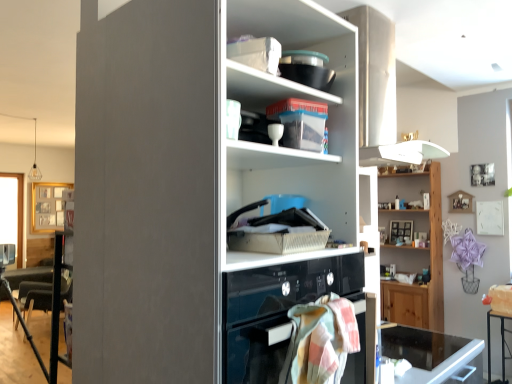
Image resolution: width=512 pixels, height=384 pixels. I want to click on pastel plaid towel at lower center, so click(x=321, y=341).

Identify the location of translucent plastic container at upper center, the first shelf viewed from the top. (270, 85).

Measure the distance between point (272,82) and camera.

A distance of 1.19 meters exists between point (272,82) and camera.

This screenshot has width=512, height=384. I want to click on white glossy cupboard at center, so click(x=202, y=192).

Is pastel plaid towel at lower center positioned with its back to white glossy cupboard at center?

pastel plaid towel at lower center does not have its back to white glossy cupboard at center.

From a real-world perspective, does pastel plaid towel at lower center stand above white glossy cupboard at center?

Actually, pastel plaid towel at lower center is physically below white glossy cupboard at center in the real world.

Can you confirm if pastel plaid towel at lower center is shorter than white glossy cupboard at center?

Indeed, pastel plaid towel at lower center has a lesser height compared to white glossy cupboard at center.

From a real-world perspective, which object rests below the other?

In real-world perspective, black glass desk at lower right is lower.

From the image's perspective, would you say white glossy cupboard at center is shown under black glass desk at lower right?

No.

How much distance is there between white glossy cupboard at center and black glass desk at lower right?

white glossy cupboard at center and black glass desk at lower right are 1.20 meters apart.

Is point (356, 51) behind point (429, 337)?

No, (356, 51) is in front of (429, 337).

Is translucent plastic container at upper center, which is counted as the 2th shelf, starting from the bottom, aimed at pastel plaid towel at lower center?

No, translucent plastic container at upper center, which is counted as the 2th shelf, starting from the bottom, is not turned towards pastel plaid towel at lower center.

Locate an element on the screen. Image resolution: width=512 pixels, height=384 pixels. shelf above the pastel plaid towel at lower center (from the image's perspective) is located at coordinates (270, 85).

In terms of width, does translucent plastic container at upper center, the first shelf viewed from the top, look wider or thinner when compared to pastel plaid towel at lower center?

Clearly, translucent plastic container at upper center, the first shelf viewed from the top, has more width compared to pastel plaid towel at lower center.

Do you think translucent plastic container at upper center, the 2th shelf viewed from the back, is within pastel plaid towel at lower center, or outside of it?

The correct answer is: outside.

The width and height of the screenshot is (512, 384). In order to click on blanket on the left of black glass desk at lower right in this screenshot , I will do `click(321, 341)`.

From the image's perspective, who appears lower, pastel plaid towel at lower center or black glass desk at lower right?

From the image's view, black glass desk at lower right is below.

What's the angular difference between pastel plaid towel at lower center and black glass desk at lower right's facing directions?

90 degrees.

Considering the relative sizes of pastel plaid towel at lower center and black glass desk at lower right in the image provided, is pastel plaid towel at lower center thinner than black glass desk at lower right?

Indeed, pastel plaid towel at lower center has a lesser width compared to black glass desk at lower right.

Does point (249, 75) lie behind point (220, 200)?

Yes, it is.

Which of these two, translucent plastic container at upper center, which is the second shelf in right-to-left order, or white glossy cupboard at center, is smaller?

translucent plastic container at upper center, which is the second shelf in right-to-left order, is smaller.

Is translucent plastic container at upper center, the 2th shelf viewed from the back, in front of or behind white glossy cupboard at center in the image?

Visually, translucent plastic container at upper center, the 2th shelf viewed from the back, is located behind white glossy cupboard at center.

Is translucent plastic container at upper center, the 2th shelf viewed from the back, wider than white glossy cupboard at center?

No.

Find the location of a particular element. cupboard above the wooden shelf at upper right, which is the second shelf from left to right (from the image's perspective) is located at coordinates (202, 192).

From the image's perspective, is white glossy cupboard at center located beneath wooden shelf at upper right, acting as the second shelf starting from the top?

No, from the image's perspective, white glossy cupboard at center is not beneath wooden shelf at upper right, acting as the second shelf starting from the top.

Which is behind, point (215, 86) or point (415, 287)?

The point (415, 287) is farther.

Considering the relative sizes of white glossy cupboard at center and wooden shelf at upper right, marked as the 1th shelf in a right-to-left arrangement, in the image provided, is white glossy cupboard at center shorter than wooden shelf at upper right, marked as the 1th shelf in a right-to-left arrangement,?

Yes, white glossy cupboard at center is shorter than wooden shelf at upper right, marked as the 1th shelf in a right-to-left arrangement.

How much distance is there between white glossy cupboard at center and pastel plaid towel at lower center?

white glossy cupboard at center is 41.71 centimeters from pastel plaid towel at lower center.

Is white glossy cupboard at center completely or partially outside of pastel plaid towel at lower center?

Indeed, white glossy cupboard at center is completely outside pastel plaid towel at lower center.

Considering the sizes of objects white glossy cupboard at center and pastel plaid towel at lower center in the image provided, who is taller, white glossy cupboard at center or pastel plaid towel at lower center?

With more height is white glossy cupboard at center.

From the image's perspective, is white glossy cupboard at center above pastel plaid towel at lower center?

Yes, from the image's perspective, white glossy cupboard at center is on top of pastel plaid towel at lower center.

Identify the location of cupboard lying above the pastel plaid towel at lower center (from the image's perspective). (202, 192).

Where is `desk below the white glossy cupboard at center (from the image's perspective)`? desk below the white glossy cupboard at center (from the image's perspective) is located at coordinates (433, 355).

Looking at the image, which one is located closer to white glossy cupboard at center, black glass desk at lower right or pastel plaid towel at lower center?

pastel plaid towel at lower center lies closer to white glossy cupboard at center than the other object.

Which object lies further to the anchor point pastel plaid towel at lower center, white glossy cupboard at center or wooden shelf at upper right, placed as the 1th shelf when sorted from bottom to top?

The object further to pastel plaid towel at lower center is wooden shelf at upper right, placed as the 1th shelf when sorted from bottom to top.

Which object lies further to the anchor point translucent plastic container at upper center, which is the second shelf in right-to-left order, wooden shelf at upper right, which is the 1th shelf in back-to-front order, or white glossy cupboard at center?

wooden shelf at upper right, which is the 1th shelf in back-to-front order, lies further to translucent plastic container at upper center, which is the second shelf in right-to-left order, than the other object.

Based on their spatial positions, is white glossy cupboard at center or wooden shelf at upper right, which is the 1th shelf in back-to-front order, closer to black glass desk at lower right?

white glossy cupboard at center.

Looking at the image, which one is located further to black glass desk at lower right, white glossy cupboard at center or pastel plaid towel at lower center?

Based on the image, white glossy cupboard at center appears to be further to black glass desk at lower right.

From the image, which object appears to be farther from pastel plaid towel at lower center, translucent plastic container at upper center, the first shelf viewed from the top, or wooden shelf at upper right, which is the 1th shelf in back-to-front order?

The object further to pastel plaid towel at lower center is wooden shelf at upper right, which is the 1th shelf in back-to-front order.

Estimate the real-world distances between objects in this image. Which object is further from translucent plastic container at upper center, which is counted as the 2th shelf, starting from the bottom, wooden shelf at upper right, which is the second shelf from left to right, or black glass desk at lower right?

wooden shelf at upper right, which is the second shelf from left to right, is further to translucent plastic container at upper center, which is counted as the 2th shelf, starting from the bottom.

From the image, which object appears to be nearer to wooden shelf at upper right, placed as the 1th shelf when sorted from bottom to top, translucent plastic container at upper center, which is the second shelf in right-to-left order, or black glass desk at lower right?

Based on the image, black glass desk at lower right appears to be nearer to wooden shelf at upper right, placed as the 1th shelf when sorted from bottom to top.

Identify the location of blanket between white glossy cupboard at center and black glass desk at lower right in the up-down direction. (321, 341).

Find the location of `shelf between pastel plaid towel at lower center and wooden shelf at upper right, which is the 1th shelf in back-to-front order, from front to back`. shelf between pastel plaid towel at lower center and wooden shelf at upper right, which is the 1th shelf in back-to-front order, from front to back is located at coordinates (270, 85).

Find the location of a particular element. The width and height of the screenshot is (512, 384). desk located between pastel plaid towel at lower center and wooden shelf at upper right, placed as the 1th shelf when sorted from bottom to top, in the depth direction is located at coordinates (433, 355).

Find the location of a particular element. Image resolution: width=512 pixels, height=384 pixels. shelf located between white glossy cupboard at center and wooden shelf at upper right, which is the second shelf from left to right, in the depth direction is located at coordinates (270, 85).